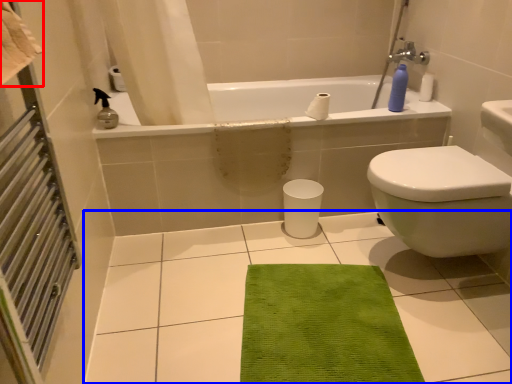
Question: Which object appears closest to the camera in this image, beach towel (highlighted by a red box) or ceramic tile (highlighted by a blue box)?

Choices:
 (A) beach towel
 (B) ceramic tile

Answer: (A)